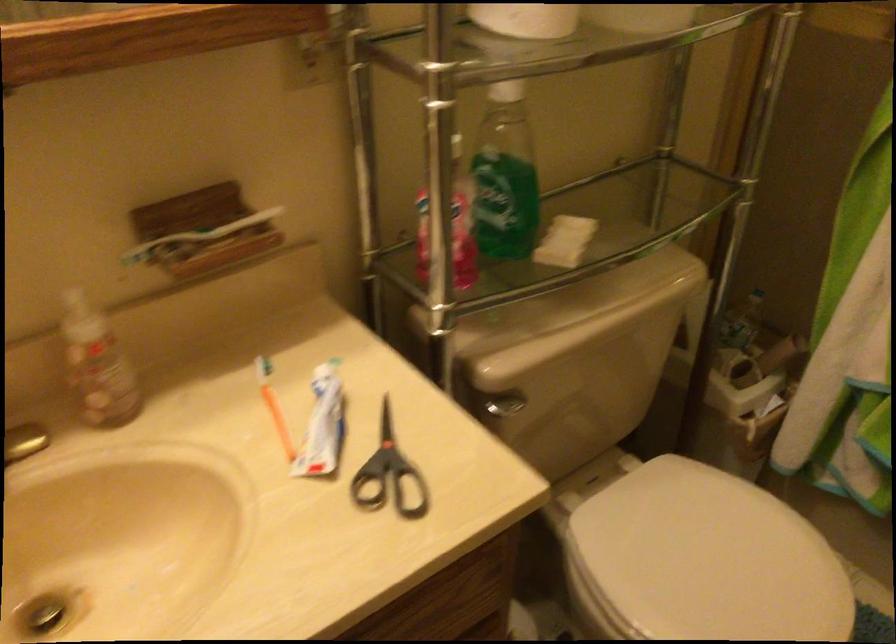
This screenshot has width=896, height=644. Find the location of `black scissor handle`. black scissor handle is located at coordinates (391, 489).